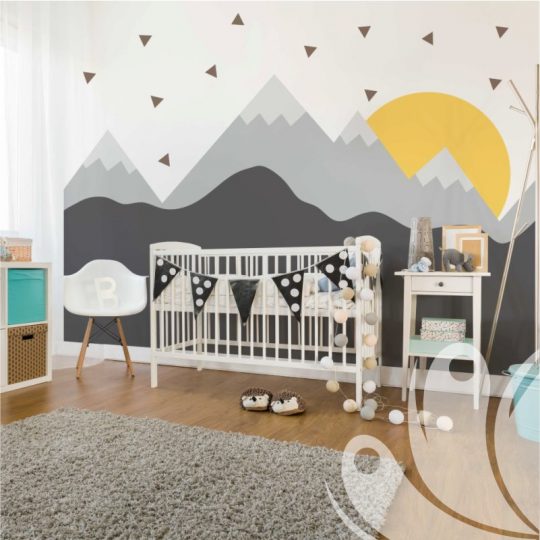
Identify the location of crib. (237, 359).